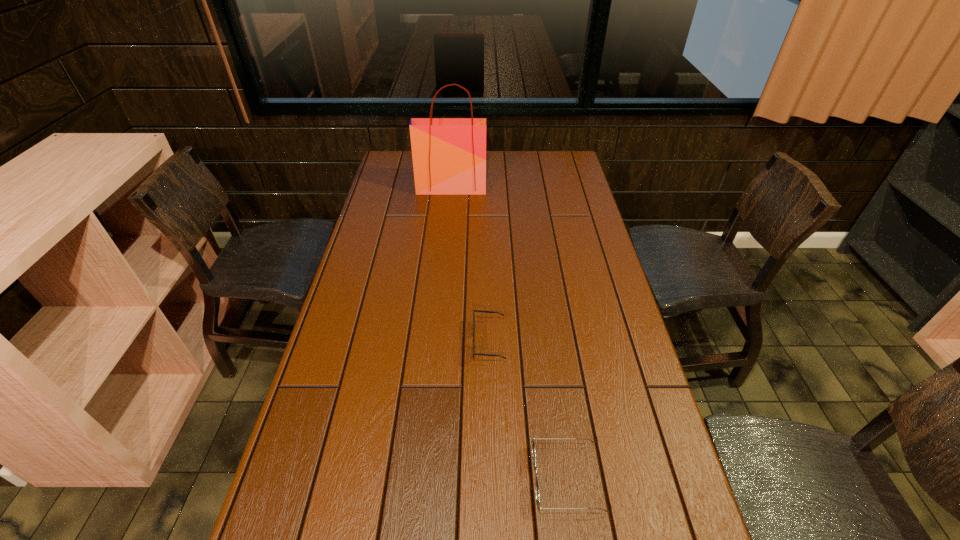
Where is `the farthest object`? The height and width of the screenshot is (540, 960). the farthest object is located at coordinates (449, 154).

You are a GUI agent. You are given a task and a screenshot of the screen. Output one action in this format:
    pyautogui.click(x=<x>, y=<y>)
    Task: Click on the tallest object
    Image resolution: width=960 pixels, height=540 pixels.
    Given the screenshot: What is the action you would take?
    pyautogui.click(x=449, y=154)

Image resolution: width=960 pixels, height=540 pixels. Find the location of `the second sunglasses from right to left`. the second sunglasses from right to left is located at coordinates (473, 310).

Locate an element on the screen. the second farthest object is located at coordinates (473, 310).

This screenshot has height=540, width=960. I want to click on the rightmost object, so click(533, 443).

The image size is (960, 540). I want to click on the second farthest sunglasses, so click(x=533, y=443).

Where is `vacant area situated on the handle side of the shopping bag`? vacant area situated on the handle side of the shopping bag is located at coordinates (445, 254).

At what (x,y) coordinates should I click in order to perform the action: click on vacant space located 0.280m on the front-facing side of the farthest sunglasses. Please return your answer as a coordinate pair (x, y). Looking at the image, I should click on (371, 341).

The image size is (960, 540). I want to click on vacant space located on the front-facing side of the farthest sunglasses, so pos(429,341).

I want to click on free location located 0.310m on the front-facing side of the farthest sunglasses, so click(359, 341).